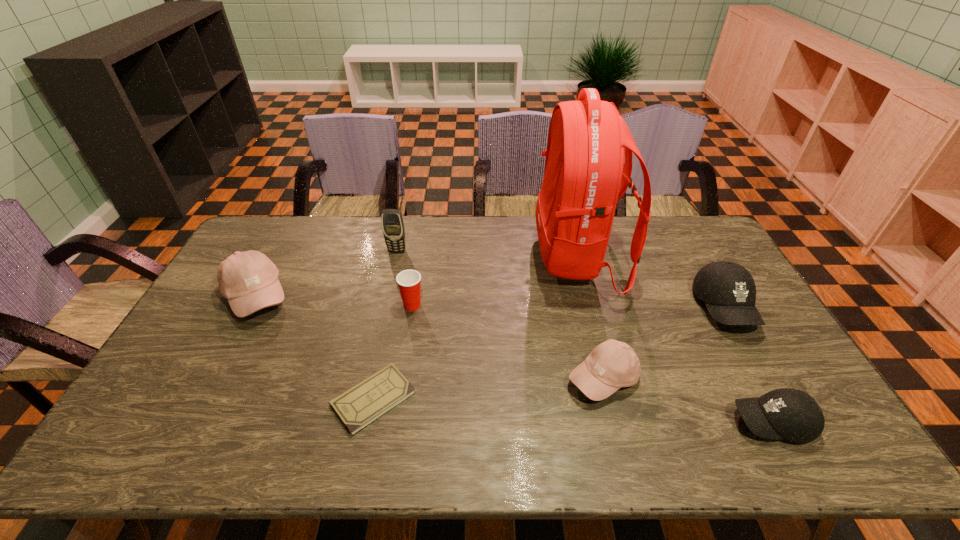
Where is `the shortest object`? This screenshot has width=960, height=540. the shortest object is located at coordinates (361, 405).

The height and width of the screenshot is (540, 960). I want to click on vacant space situated 0.060m on the main compartment of the tallest object, so click(518, 258).

I want to click on free space located on the main compartment of the tallest object, so click(x=461, y=258).

This screenshot has height=540, width=960. What are the coordinates of `free space located on the main compartment of the tallest object` in the screenshot? It's located at (449, 258).

Find the location of a particular element. free region located 0.190m on the front face of the second tallest object is located at coordinates [x=388, y=291].

Where is `vacant area situated on the front-facing side of the leftmost object`? The width and height of the screenshot is (960, 540). vacant area situated on the front-facing side of the leftmost object is located at coordinates (380, 296).

What are the coordinates of `vacant space positioned on the front-facing side of the farther black baseball cap` in the screenshot? It's located at (782, 409).

Find the location of `vacant area situated 0.140m on the right of the Dixie cup`. vacant area situated 0.140m on the right of the Dixie cup is located at coordinates (468, 305).

Where is `vacant space positioned 0.050m on the front-facing side of the smaller pink baseball cap`? vacant space positioned 0.050m on the front-facing side of the smaller pink baseball cap is located at coordinates (614, 425).

I want to click on free region located on the front-facing side of the nearer black baseball cap, so click(x=703, y=422).